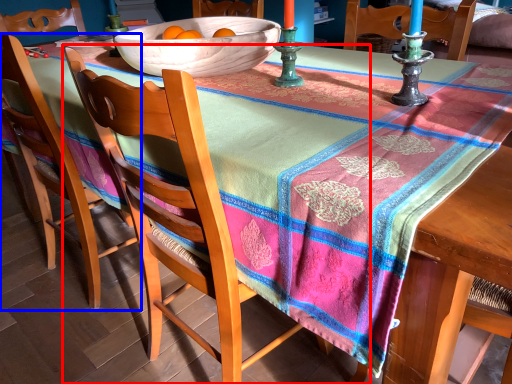
Question: Which point is further to the camera, chair (highlighted by a red box) or chair (highlighted by a blue box)?

Choices:
 (A) chair
 (B) chair

Answer: (B)